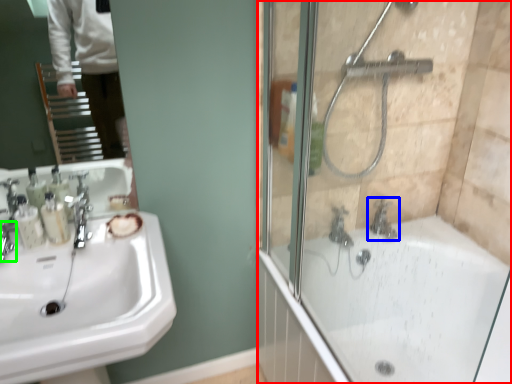
Question: Considering the real-world distances, which object is farthest from screen door (highlighted by a red box)? tap (highlighted by a blue box) or faucet (highlighted by a green box)?

Choices:
 (A) tap
 (B) faucet

Answer: (B)